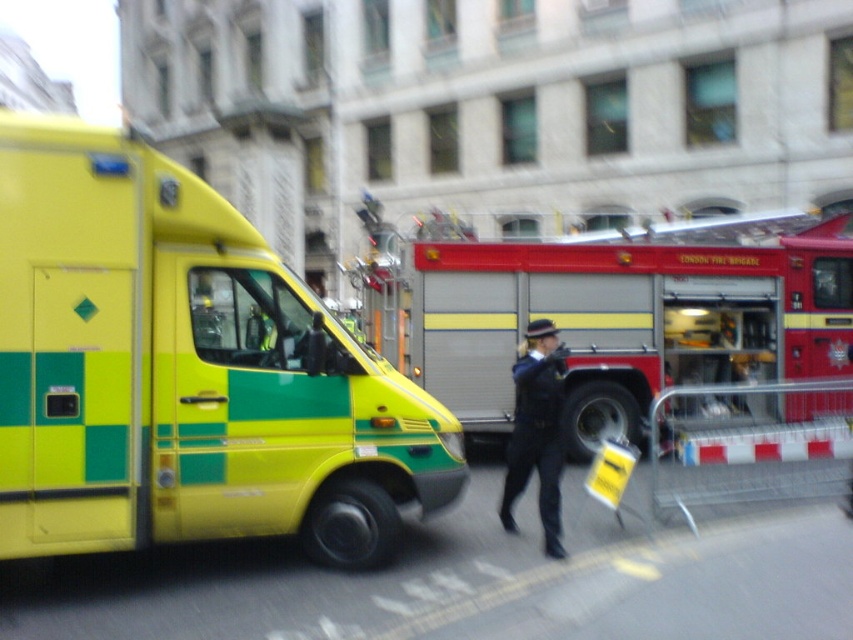
Question: Which of the following is the farthest from the observer?

Choices:
 (A) dark blue uniform at center
 (B) red metallic fire truck at center
 (C) yellow/green checkered ambulance at left

Answer: (B)

Question: Can you confirm if yellow/green checkered ambulance at left is thinner than red metallic fire truck at center?

Choices:
 (A) yes
 (B) no

Answer: (A)

Question: Does yellow/green checkered ambulance at left appear under red metallic fire truck at center?

Choices:
 (A) yes
 (B) no

Answer: (A)

Question: Considering the real-world distances, which object is farthest from the yellow/green checkered ambulance at left?

Choices:
 (A) red metallic fire truck at center
 (B) dark blue uniform at center

Answer: (A)

Question: Which of the following is the farthest from the observer?

Choices:
 (A) (735, 300)
 (B) (54, 172)

Answer: (A)

Question: Can you confirm if yellow/green checkered ambulance at left is thinner than dark blue uniform at center?

Choices:
 (A) yes
 (B) no

Answer: (B)